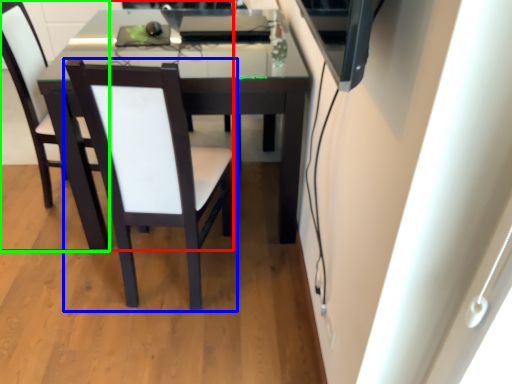
Question: Which object is the farthest from chair (highlighted by a red box)? Choose among these: chair (highlighted by a blue box) or chair (highlighted by a green box).

Choices:
 (A) chair
 (B) chair

Answer: (A)